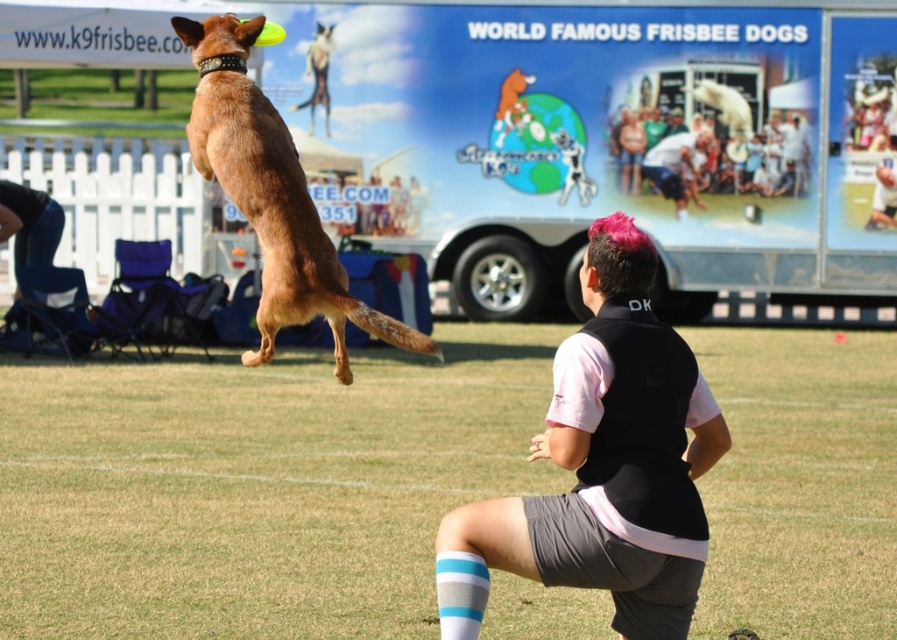
Does pink hair at center appear under brown matte dog at upper left?

Correct, pink hair at center is located below brown matte dog at upper left.

Is point (676, 454) more distant than point (254, 208)?

No, it is in front of (254, 208).

The image size is (897, 640). What are the coordinates of `pink hair at center` in the screenshot? It's located at pos(603,465).